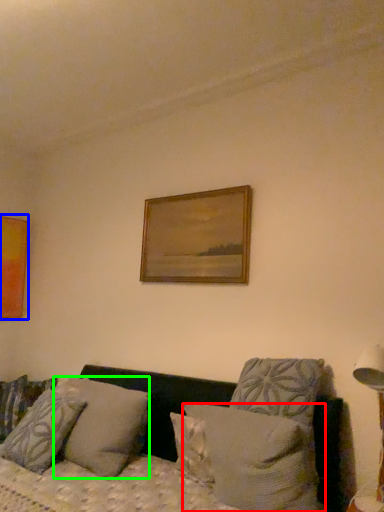
Question: Which object is the closest to the pillow (highlighted by a red box)? Choose among these: picture frame (highlighted by a blue box) or pillow (highlighted by a green box).

Choices:
 (A) picture frame
 (B) pillow

Answer: (B)